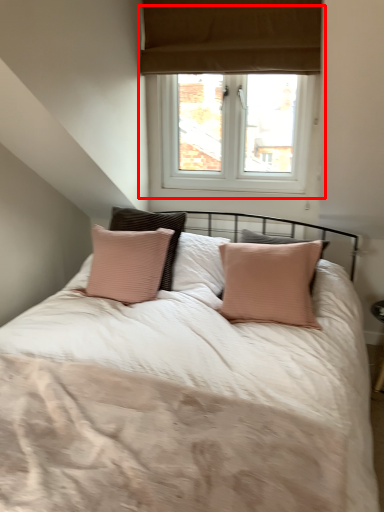
Question: From the image's perspective, where is window (annotated by the red box) located relative to bed?

Choices:
 (A) below
 (B) above

Answer: (B)